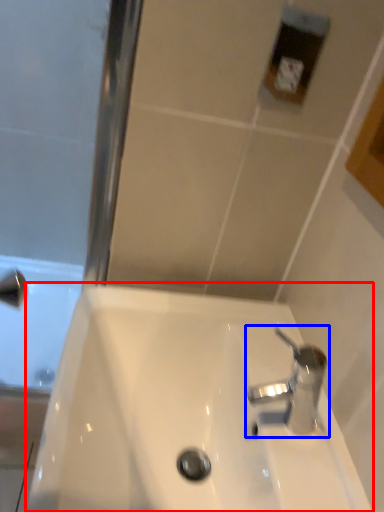
Question: Which of the following is the farthest to the observer, sink (highlighted by a red box) or tap (highlighted by a blue box)?

Choices:
 (A) sink
 (B) tap

Answer: (B)